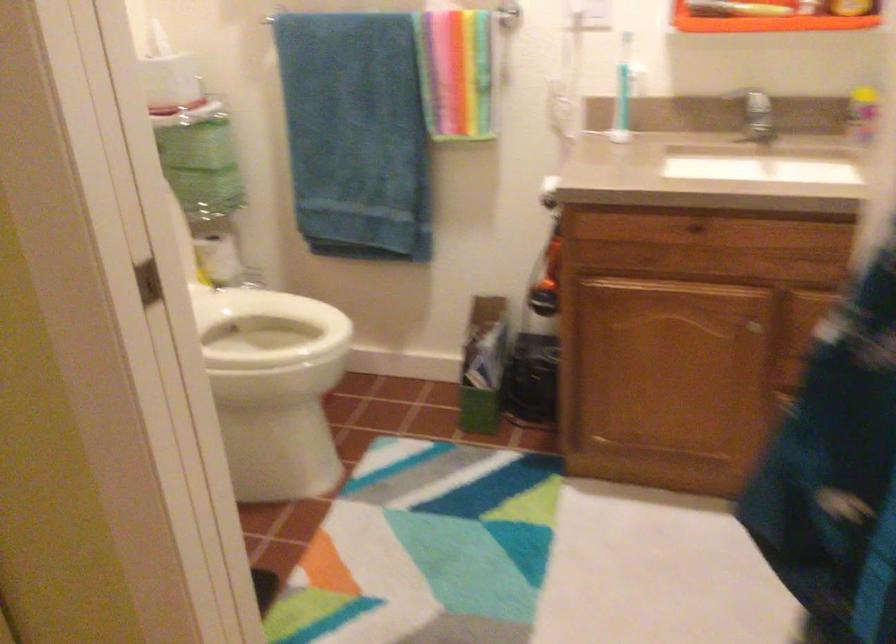
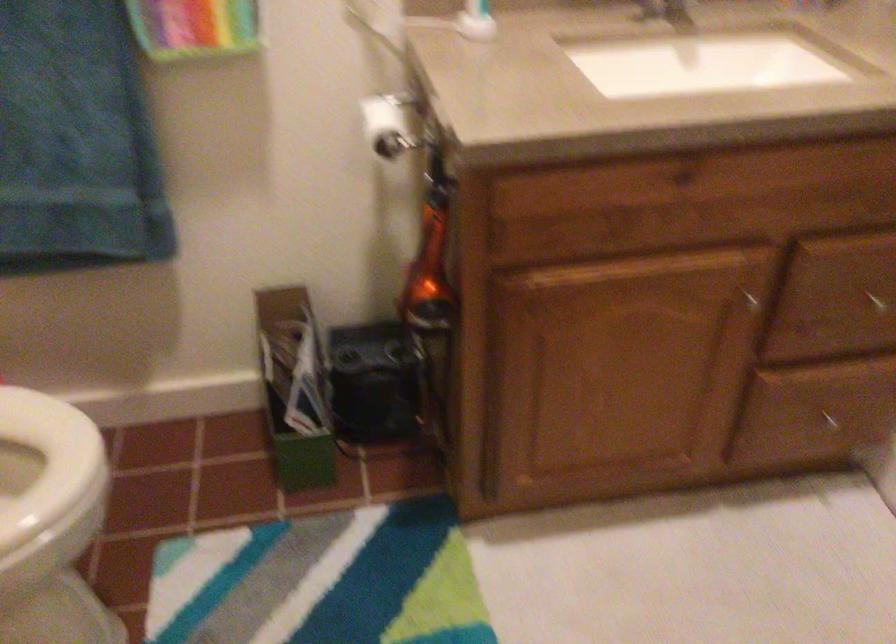
In the second image, find the point that corresponds to point (553, 270) in the first image.

(429, 267)